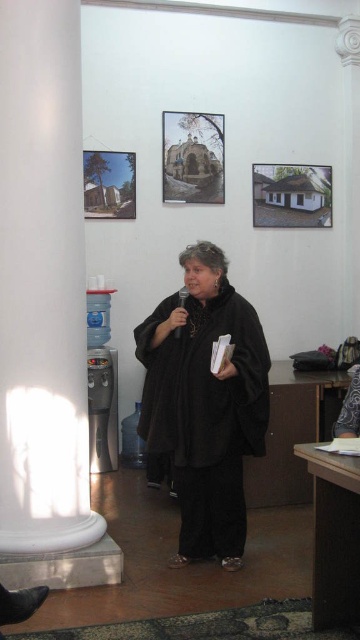
Can you confirm if white marble pillar at left is bigger than black matte coat at center?

Yes.

Is white marble pillar at left wider than black matte coat at center?

No.

Locate an element on the screen. This screenshot has width=360, height=640. white marble pillar at left is located at coordinates (45, 308).